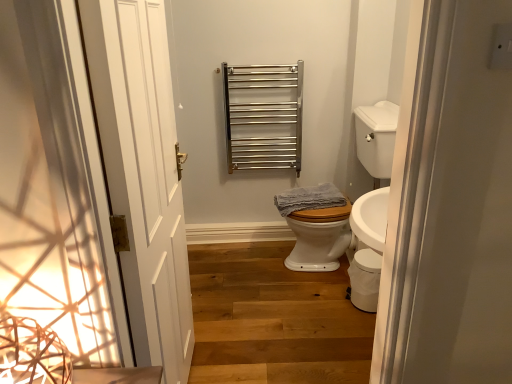
Identify the location of vacant area in front of white glossy toilet bowl at lower right. (357, 325).